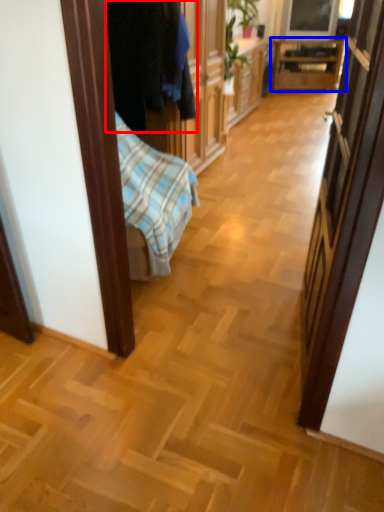
Question: Which object is further to the camera taking this photo, clothing (highlighted by a red box) or table (highlighted by a blue box)?

Choices:
 (A) clothing
 (B) table

Answer: (B)